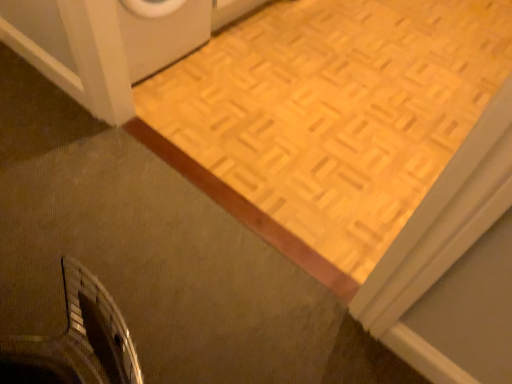
Image resolution: width=512 pixels, height=384 pixels. Describe the element at coordinates (161, 32) in the screenshot. I see `matte white washing machine at upper left` at that location.

Locate an element on the screen. Image resolution: width=512 pixels, height=384 pixels. matte white washing machine at upper left is located at coordinates (161, 32).

Measure the distance between point [142,25] and camera.

The depth of point [142,25] is 5.76 feet.

Where is `matte white washing machine at upper left`? The image size is (512, 384). matte white washing machine at upper left is located at coordinates (161, 32).